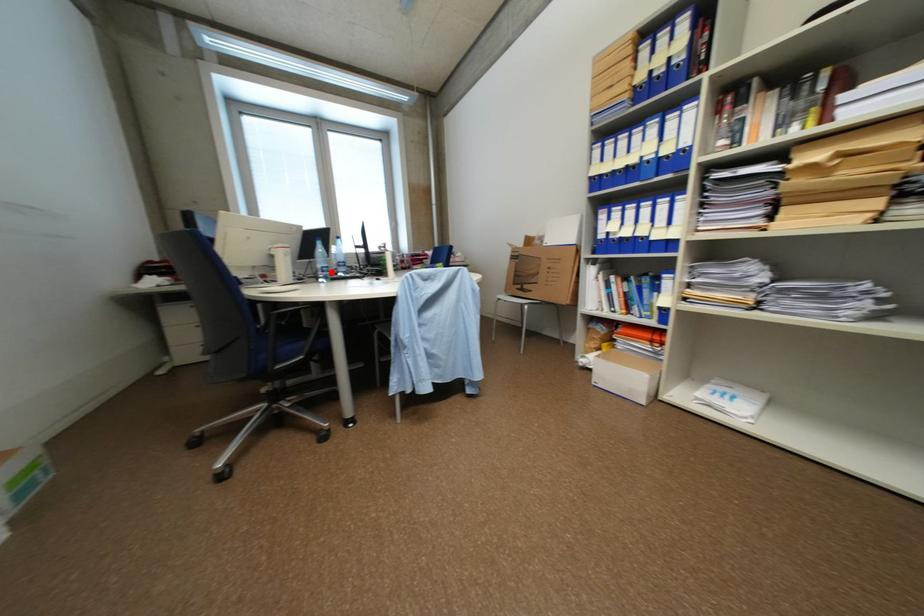
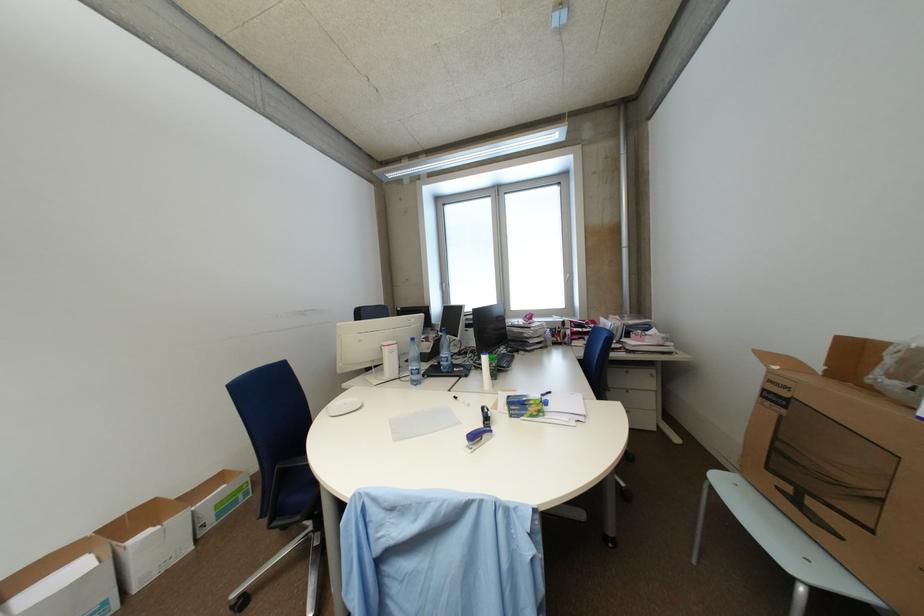
Question: I am providing you with two images of the same scene from different viewpoints. A red point is marked on the first image. At the location where the point appears in image 1, is it still visible in image 2?

Choices:
 (A) Yes
 (B) No

Answer: (A)